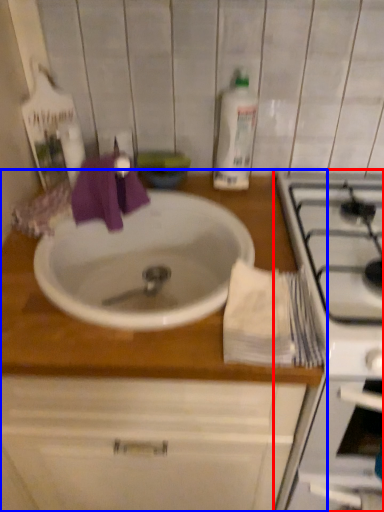
Question: Which point is further to the camera, appliance (highlighted by a red box) or countertop (highlighted by a blue box)?

Choices:
 (A) appliance
 (B) countertop

Answer: (B)